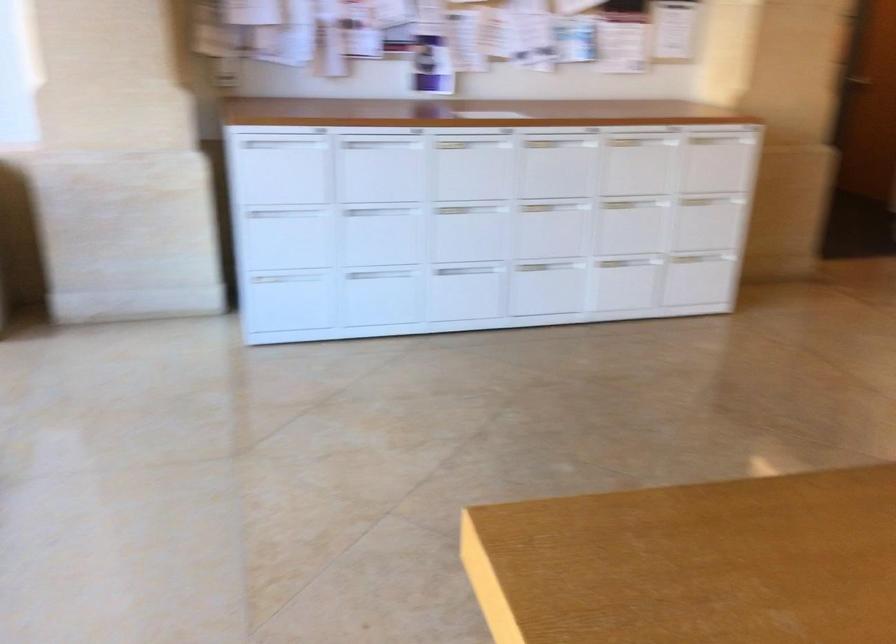
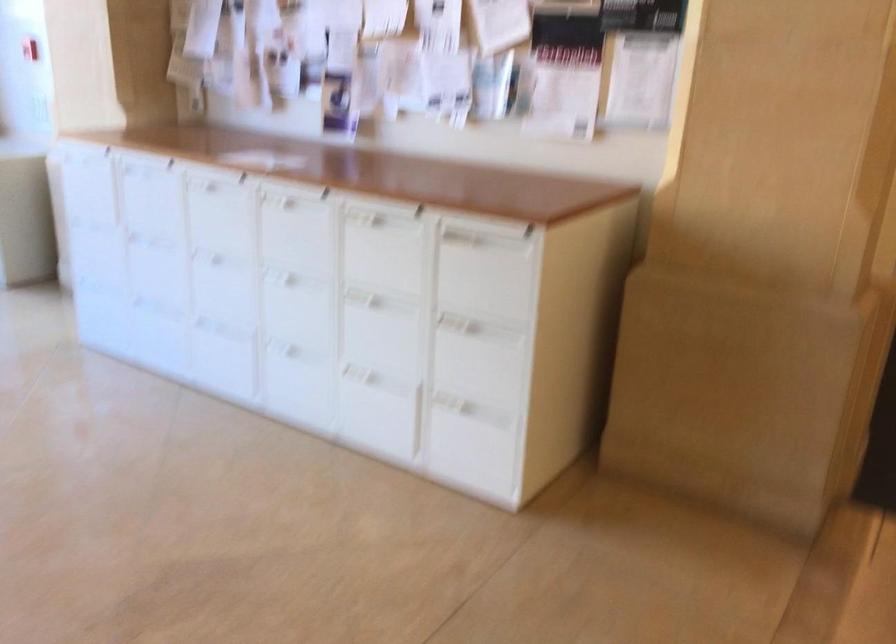
The point at (632, 152) is marked in the first image. Where is the corresponding point in the second image?

(382, 247)